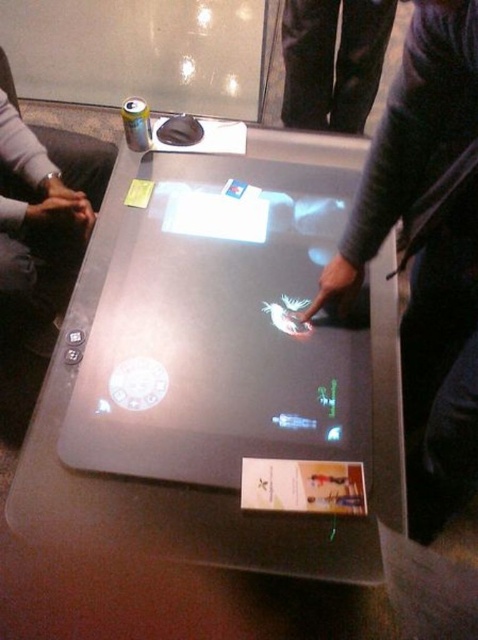
Can you confirm if matte black laptop at center is thinner than black jeans at upper center?

In fact, matte black laptop at center might be wider than black jeans at upper center.

Between point (319, 372) and point (282, 116), which one is positioned behind?

Point (282, 116)

Is point (142, 362) in front of point (322, 125)?

Yes, point (142, 362) is closer to viewer.

Locate an element on the screen. This screenshot has width=478, height=640. matte black laptop at center is located at coordinates (219, 330).

Is matte black laptop at center above white matte card game at center?

Yes.

Describe the element at coordinates (219, 330) in the screenshot. The height and width of the screenshot is (640, 478). I see `matte black laptop at center` at that location.

Who is more distant from viewer, [185,378] or [341,465]?

The point [185,378] is more distant.

What are the coordinates of `matte black laptop at center` in the screenshot? It's located at (219, 330).

Can you confirm if black jeans at upper center is thinner than white matte card game at center?

In fact, black jeans at upper center might be wider than white matte card game at center.

Between black jeans at upper center and white matte card game at center, which one has less height?

white matte card game at center is shorter.

Measure the distance between black jeans at upper center and camera.

They are 4.90 feet apart.

Find the location of a particular element. black jeans at upper center is located at coordinates (333, 61).